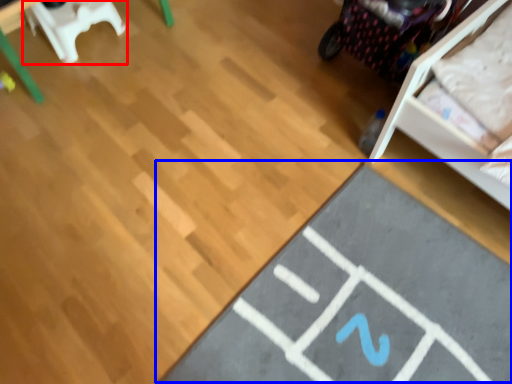
Question: Which object is further to the camera taking this photo, furniture (highlighted by a red box) or yoga mat (highlighted by a blue box)?

Choices:
 (A) furniture
 (B) yoga mat

Answer: (A)